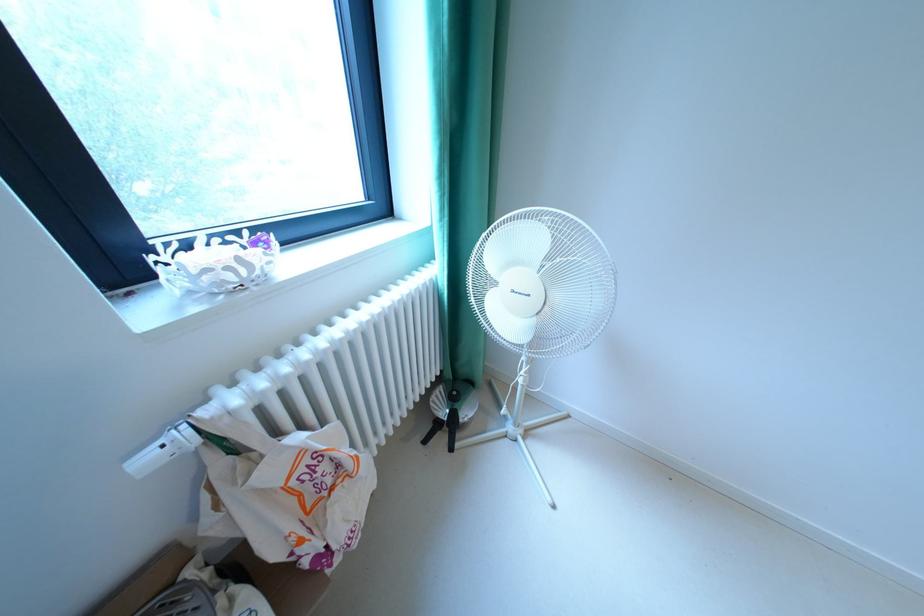
Where is `radiator valve`? The height and width of the screenshot is (616, 924). radiator valve is located at coordinates (168, 448).